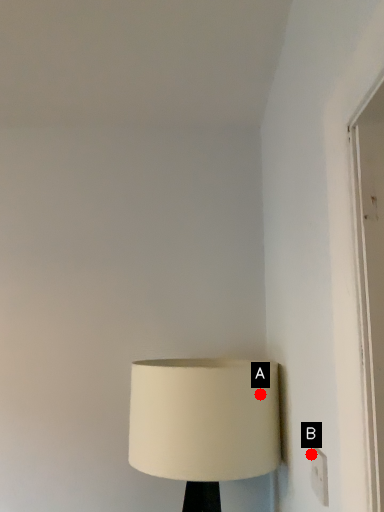
Question: Two points are circled on the image, labeled by A and B beside each circle. Which point appears closest to the camera in this image?

Choices:
 (A) A is closer
 (B) B is closer

Answer: (B)